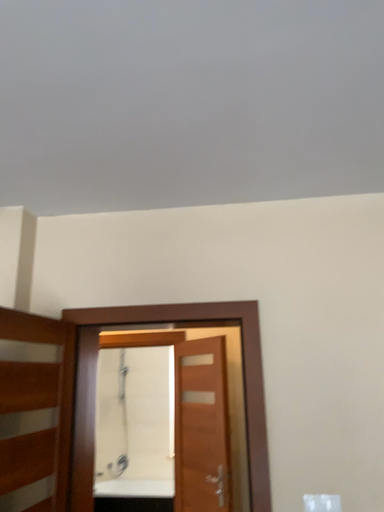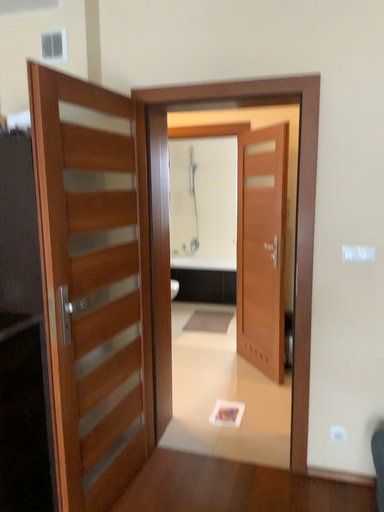
Question: How did the camera likely rotate when shooting the video?

Choices:
 (A) rotated left
 (B) rotated right

Answer: (A)